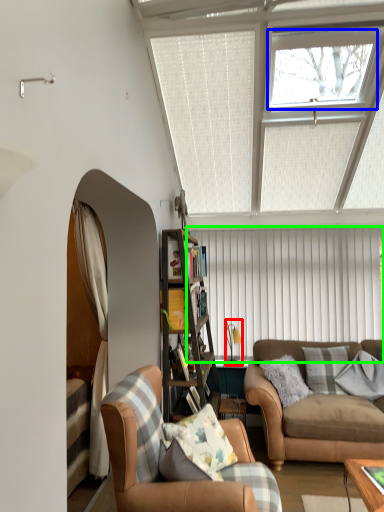
Question: Based on their relative distances, which object is farther from lamp (highlighted by a red box)? Choose from window (highlighted by a blue box) and blind (highlighted by a green box).

Choices:
 (A) window
 (B) blind

Answer: (A)